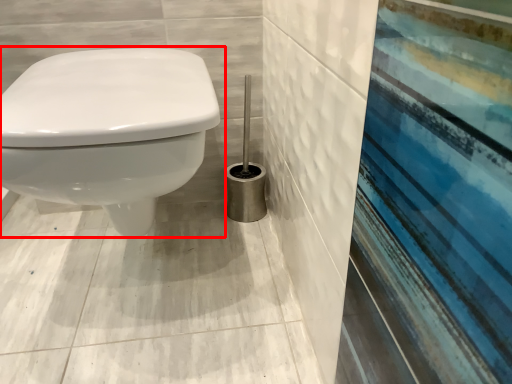
Question: From the image's perspective, where is toilet (annotated by the red box) located in relation to brush in the image?

Choices:
 (A) above
 (B) below

Answer: (B)